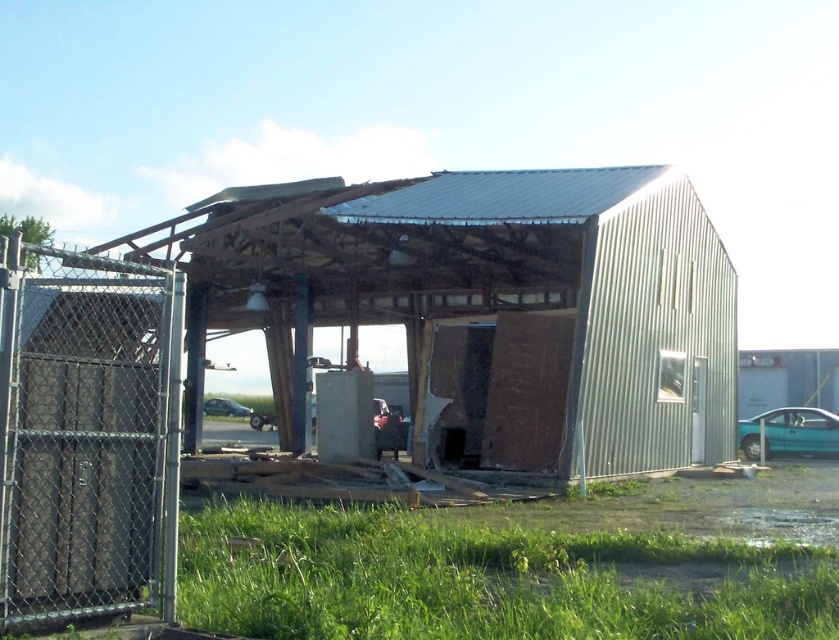
Which is above, gray chain-link fence at left or teal matte car at lower right?

gray chain-link fence at left is above.

Can you confirm if gray chain-link fence at left is shorter than teal matte car at lower right?

Incorrect, gray chain-link fence at left's height does not fall short of teal matte car at lower right's.

Does point (25, 404) come in front of point (744, 454)?

That is True.

Locate an element on the screen. Image resolution: width=839 pixels, height=640 pixels. gray chain-link fence at left is located at coordinates (87, 436).

Based on the photo, can you confirm if metallic corrugated hangar at center is positioned to the right of gray chain-link fence at left?

Correct, you'll find metallic corrugated hangar at center to the right of gray chain-link fence at left.

Does point (335, 224) come closer to viewer compared to point (82, 428)?

No, (335, 224) is further to viewer.

Where is `metallic corrugated hangar at center`? This screenshot has width=839, height=640. metallic corrugated hangar at center is located at coordinates (486, 307).

Between metallic corrugated hangar at center and teal matte car at lower right, which one is positioned higher?

metallic corrugated hangar at center is higher up.

Does point (462, 205) come closer to viewer compared to point (751, 460)?

That is True.

Does point (585, 227) lie in front of point (783, 444)?

Yes, it is.

What are the coordinates of `metallic corrugated hangar at center` in the screenshot? It's located at (486, 307).